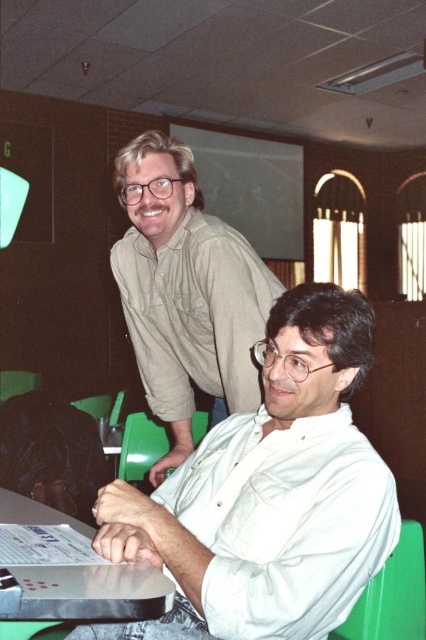
Question: Can you confirm if white plastic table at lower left is thinner than green plastic chair at lower center?

Choices:
 (A) yes
 (B) no

Answer: (B)

Question: Based on their relative distances, which object is farther from the white plastic table at lower left?

Choices:
 (A) light brown shirt at upper center
 (B) white glossy shirt at center
 (C) green plastic chair at lower center

Answer: (C)

Question: Among these objects, which one is nearest to the camera?

Choices:
 (A) white glossy shirt at center
 (B) green plastic chair at lower center

Answer: (A)

Question: Which of the following is the farthest from the observer?

Choices:
 (A) (345, 632)
 (B) (365, 502)

Answer: (A)

Question: Can you confirm if green plastic chair at lower right is positioned below green plastic chair at lower center?

Choices:
 (A) yes
 (B) no

Answer: (B)

Question: Where is white plastic table at lower left located in relation to green plastic chair at lower center in the image?

Choices:
 (A) above
 (B) below

Answer: (A)